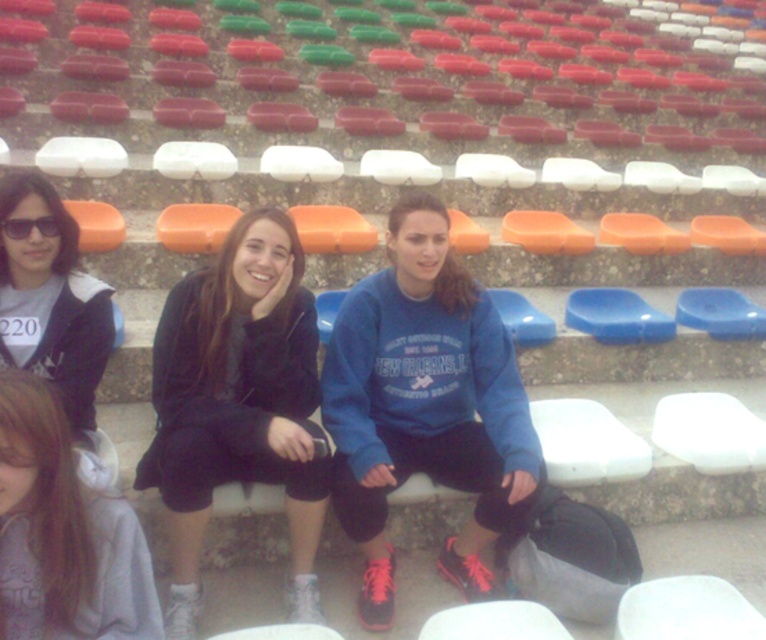
From the picture: You are standing in the stadium and want to find the black matte jacket at center. According to the coordinates provided, where should you look relative to the seating area?

The black matte jacket at center is located at coordinates point [237,403] within the seating area.